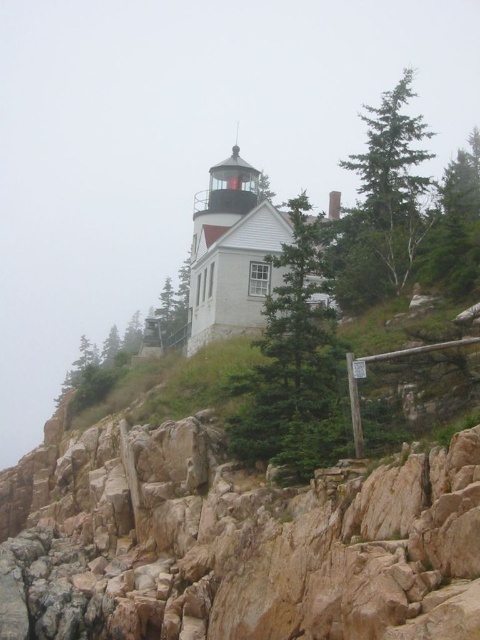
You are standing at the base of the lighthouse and want to take a photo of both the green textured tree at center and the green textured tree at upper right. Which tree should you focus on first to ensure both are in clear view?

You should focus on the green textured tree at center first because it is closer to you, so adjusting the focus from near to far will help both trees appear clear in the photo.

You are a painter setting up your easel to capture the lighthouse scene. You want to ensure that the green textured tree at center and the green matte tree at upper right are both visible in your painting. Based on their sizes, which tree should you position closer to the center of your canvas to maintain balance?

The green textured tree at center has a lesser width compared to the green matte tree at upper right. To maintain balance in the painting, position the wider green matte tree at upper right closer to the center of the canvas so that its larger size counterbalances the smaller green textured tree at center placed further out.

You are standing at the lighthouse and looking out towards the cliff edge. There is a green textured tree at center. Can you see the tree from your current position?

Yes, the green textured tree at center is located at point (295, 364), so it is visible from your position at the lighthouse.